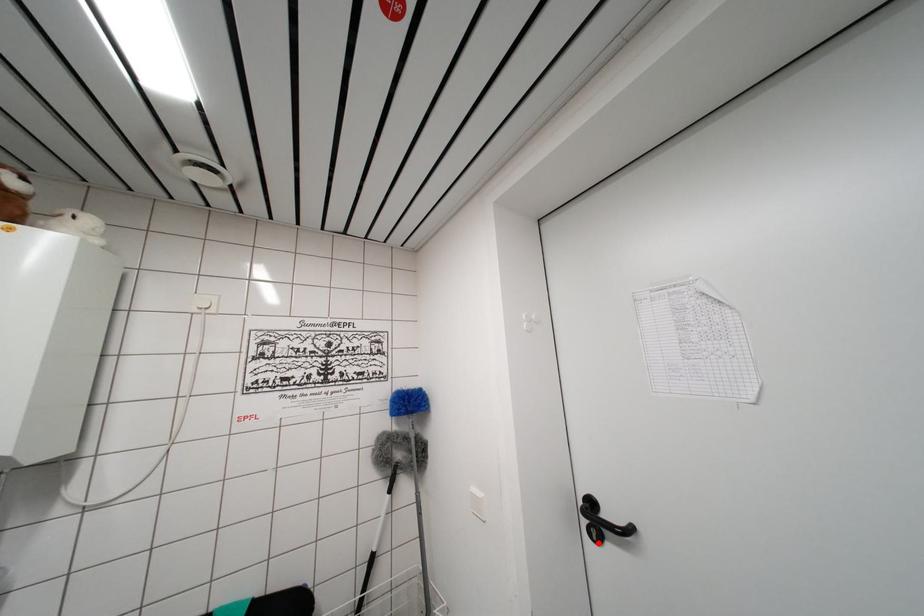
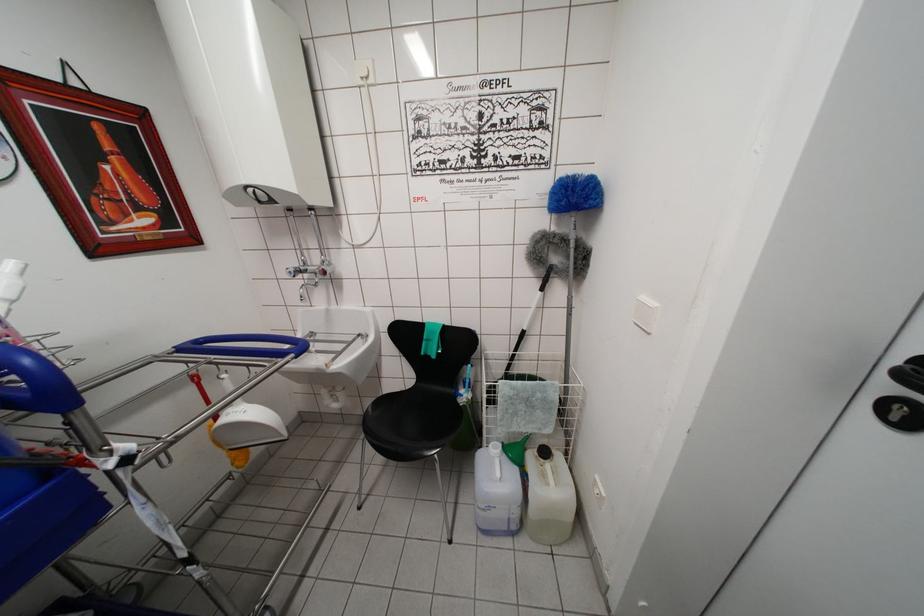
Find the pixel in the second image that matches the highlighted location in the first image.

(897, 423)